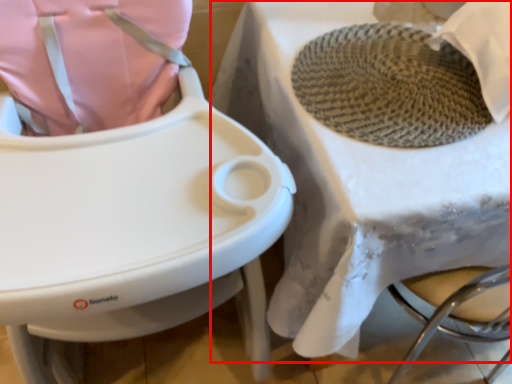
Question: From the image's perspective, where is table (annotated by the red box) located in relation to toilet in the image?

Choices:
 (A) above
 (B) below

Answer: (A)